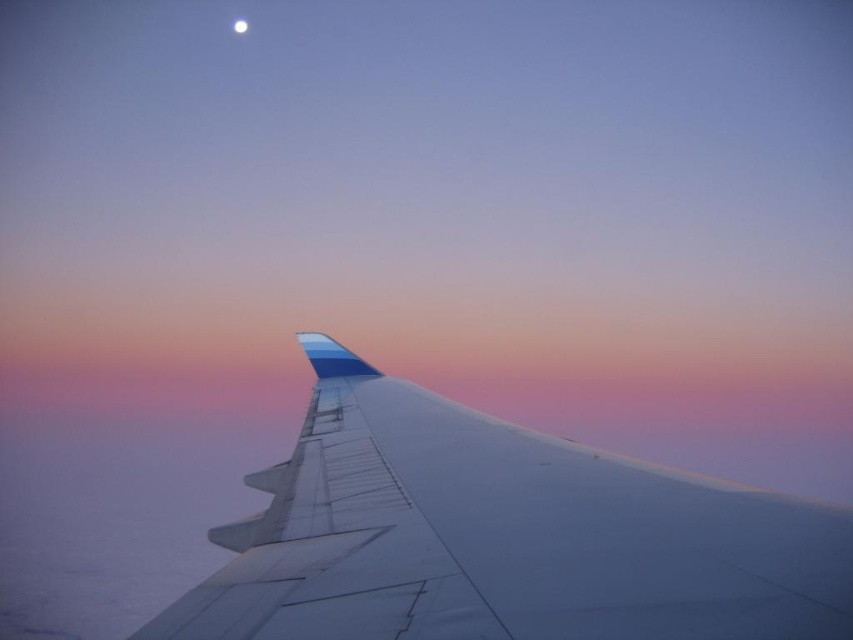
You are a passenger sitting near the window and see the white matte airplane wing at center and the white glossy moon at upper center through the window. Which object is closer to your left side?

The white glossy moon at upper center is closer to your left side because the white matte airplane wing at center is positioned on the right side of it.

You are a pilot preparing for takeoff and notice the white matte airplane wing at center and the white glossy moon at upper center in your view. Given that the moon is approximately 384,400 kilometers away from Earth, can you determine which object is closer to you?

The white matte airplane wing at center is closer to you because it is only 320.93 meters away, whereas the white glossy moon at upper center is much farther away at 384,400 kilometers.

Looking at this image, you are a pilot preparing for takeoff and notice the white matte airplane wing at center and the white glossy moon at upper center in your view. Which object appears narrower in this perspective?

The white matte airplane wing at center appears narrower than the white glossy moon at upper center in this perspective.